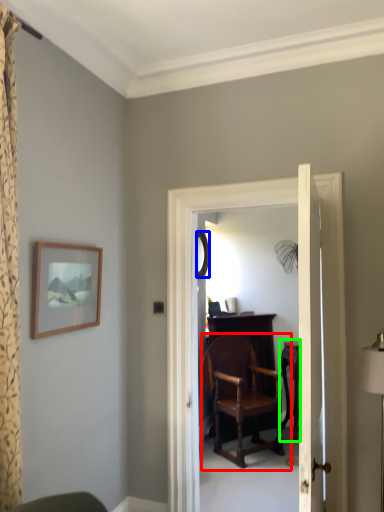
Question: Which object is the farthest from chair (highlighted by a red box)? Choose among these: mirror (highlighted by a blue box) or table (highlighted by a green box).

Choices:
 (A) mirror
 (B) table

Answer: (A)